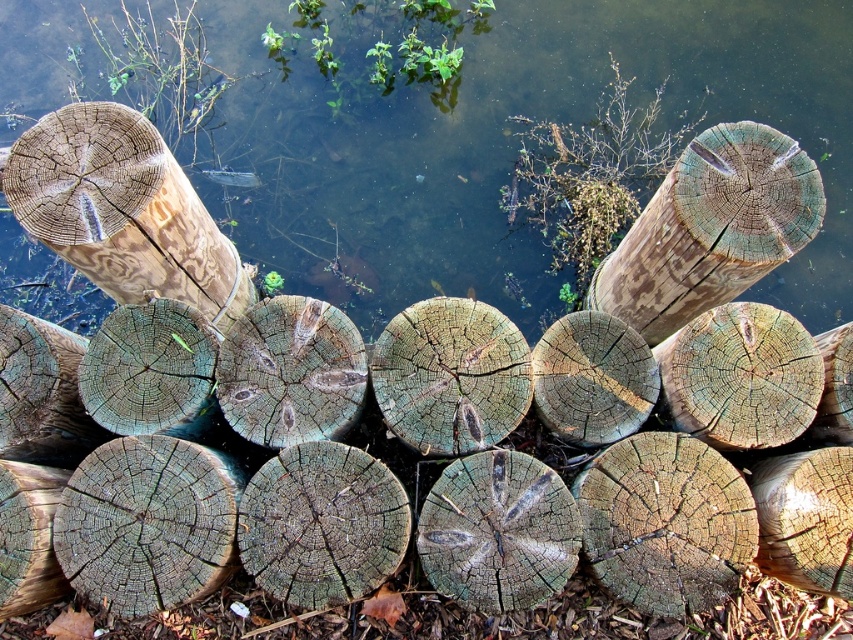
Who is positioned more to the right, weathered wood log at left or greenish-brown wood at center?

From the viewer's perspective, greenish-brown wood at center appears more on the right side.

Who is more forward, (209, 225) or (497, 380)?

Positioned in front is point (497, 380).

Is point (215, 282) positioned in front of point (402, 381)?

That is False.

You are a GUI agent. You are given a task and a screenshot of the screen. Output one action in this format:
    pyautogui.click(x=<x>, y=<y>)
    Task: Click on the weathered wood log at left
    Image resolution: width=853 pixels, height=640 pixels.
    Given the screenshot: What is the action you would take?
    pyautogui.click(x=123, y=211)

Does weathered wood log at left have a lesser height compared to weathered wood at upper right?

Yes.

Does weathered wood log at left appear under weathered wood at upper right?

Correct, weathered wood log at left is located below weathered wood at upper right.

Which is behind, point (76, 150) or point (759, 252)?

Positioned behind is point (759, 252).

The width and height of the screenshot is (853, 640). I want to click on weathered wood log at left, so click(123, 211).

Is greenish-brown water at center to the right of weathered wood at upper right from the viewer's perspective?

Incorrect, greenish-brown water at center is not on the right side of weathered wood at upper right.

Who is lower down, greenish-brown water at center or weathered wood at upper right?

Positioned lower is weathered wood at upper right.

The width and height of the screenshot is (853, 640). Identify the location of greenish-brown water at center. (502, 140).